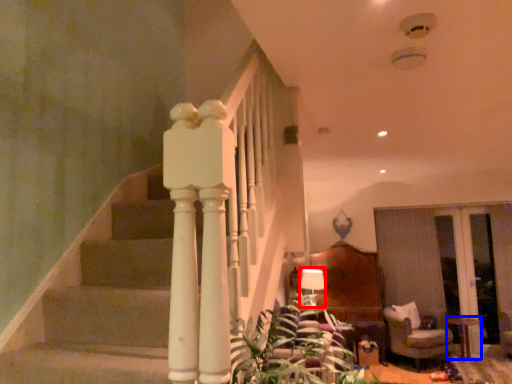
Question: Which object appears farthest to the camera in this image, lamp (highlighted by a red box) or table (highlighted by a blue box)?

Choices:
 (A) lamp
 (B) table

Answer: (A)